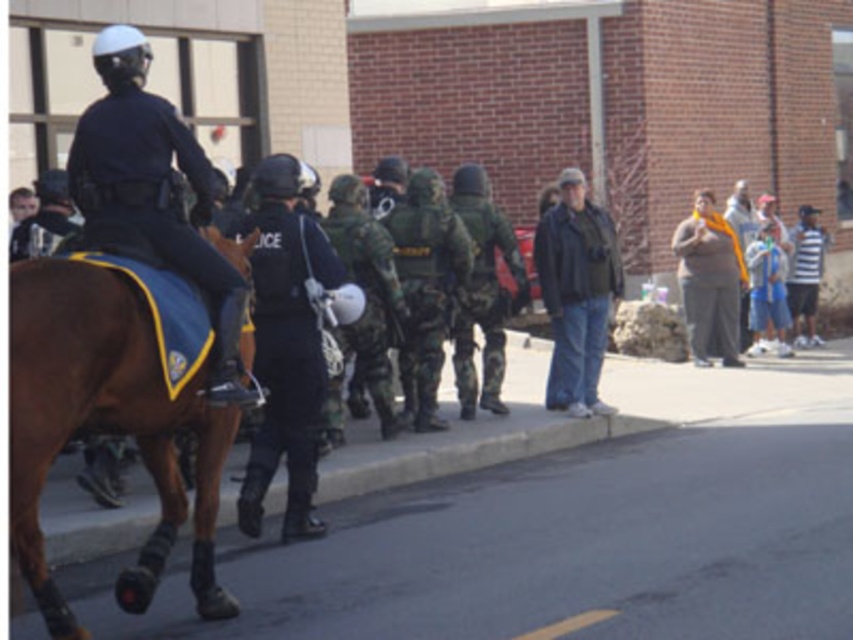
You are a photographer trying to capture a clear shot of both the mounted police officer and the tactical unit members. You notice two points marked in the image at coordinates point (28, 392) and point (289, 339). Which point is closer to your camera position?

Point (28, 392) is closer to the camera than point (289, 339).

You are a photographer trying to capture a clear image of the dark blue uniform at left and the dark blue uniform at center. Which uniform should you focus on if you want to ensure it takes up more space in your photo?

The dark blue uniform at left is wider than the dark blue uniform at center, so focusing on the dark blue uniform at left will ensure it takes up more space in the photo.

You are a photographer trying to capture a clear shot of the brown leather saddle at left and the dark blue uniform at center. Which object is located lower in the image?

The brown leather saddle at left is positioned under the dark blue uniform at center, so it is located lower in the image.